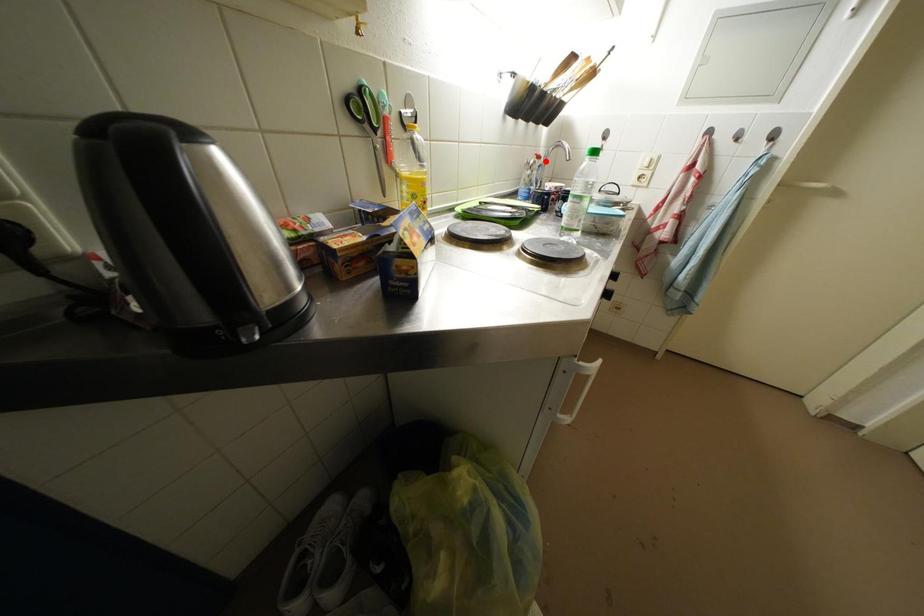
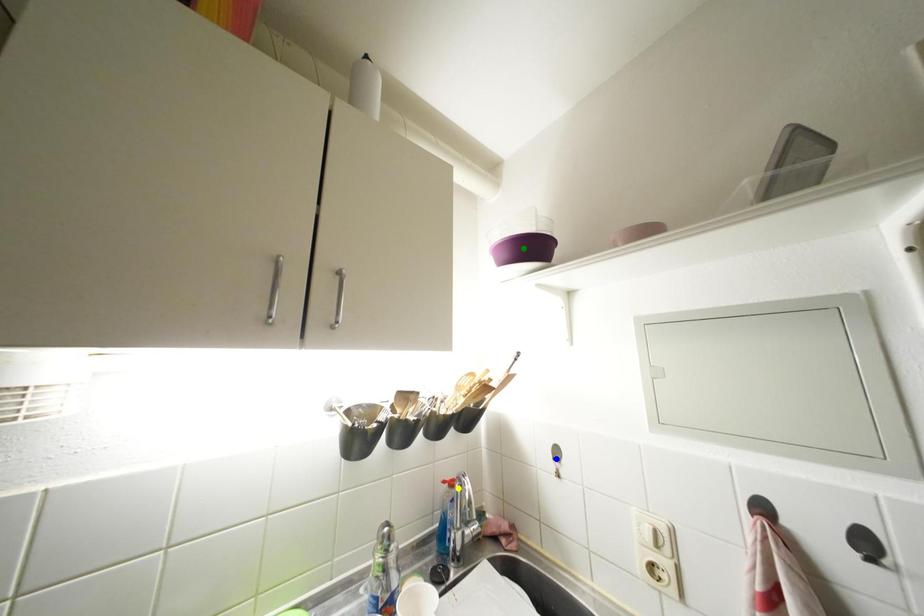
Question: I am providing you with two images of the same scene from different viewpoints. A red point is marked on the first image. You are given multiple points on the second image. Which point in image 2 is actually the same real-world point as the red point in image 1?

Choices:
 (A) yellow point
 (B) green point
 (C) blue point

Answer: (A)